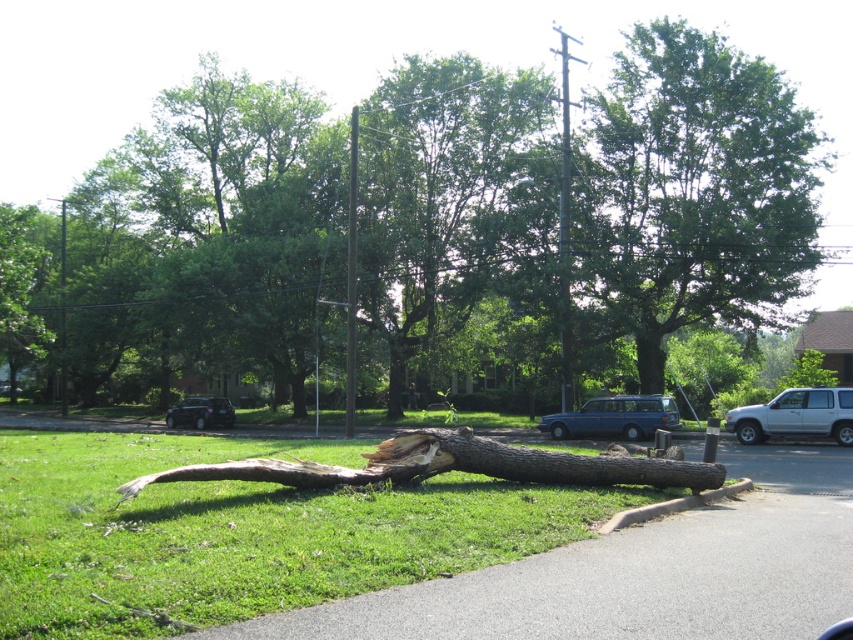
Which is behind, point (511, 42) or point (831, 412)?

The point (511, 42) is more distant.

How much distance is there between green leafy tree at center and white matte suv at lower right?

108.69 meters

Describe the element at coordinates (579, 216) in the screenshot. The image size is (853, 640). I see `green leafy tree at center` at that location.

At what (x,y) coordinates should I click in order to perform the action: click on green leafy tree at center. Please return your answer as a coordinate pair (x, y). This screenshot has height=640, width=853. Looking at the image, I should click on (579, 216).

Is brown rough wood log at center to the right of white matte suv at lower right from the viewer's perspective?

In fact, brown rough wood log at center is to the left of white matte suv at lower right.

Which of these two, brown rough wood log at center or white matte suv at lower right, stands shorter?

white matte suv at lower right is shorter.

The width and height of the screenshot is (853, 640). I want to click on brown rough wood log at center, so click(x=451, y=467).

Is green grass at lower left wider than blue metallic van at center?

Yes.

This screenshot has width=853, height=640. What are the coordinates of `green grass at lower left` in the screenshot? It's located at (244, 532).

At what (x,y) coordinates should I click in order to perform the action: click on green grass at lower left. Please return your answer as a coordinate pair (x, y). Image resolution: width=853 pixels, height=640 pixels. Looking at the image, I should click on (244, 532).